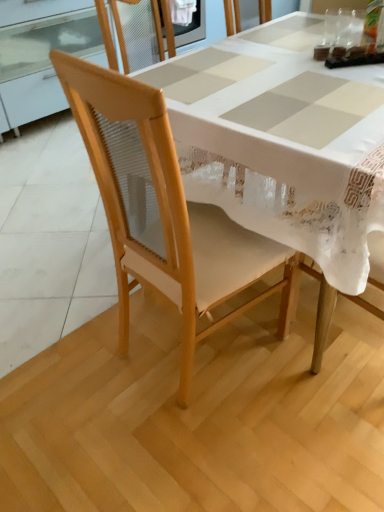
Locate an element on the screen. vacant space to the right of natural wood chair at center is located at coordinates (307, 380).